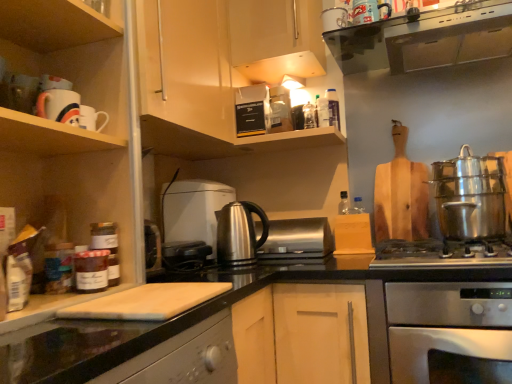
Question: In terms of width, does black granite countertop at center look wider or thinner when compared to metallic silver toaster at upper center, the 1th appliance when ordered from top to bottom?

Choices:
 (A) thin
 (B) wide

Answer: (B)

Question: From the image's perspective, is black granite countertop at center located above or below metallic silver toaster at upper center, acting as the 2th appliance starting from the bottom?

Choices:
 (A) above
 (B) below

Answer: (B)

Question: Which object is positioned closest to the stainless steel gas stove at lower right?

Choices:
 (A) wooden cutting board at upper left, acting as the first cabinetry starting from the front
 (B) black granite countertop at center
 (C) black glass range hood at upper center
 (D) metallic stainless steel kettle at center, positioned as the 1th kitchen appliance in back-to-front order
 (E) satin silver toaster at center, arranged as the second appliance when viewed from the back

Answer: (B)

Question: Which object is positioned closest to the black glass range hood at upper center?

Choices:
 (A) stainless steel gas stove at lower right
 (B) metallic stainless steel kettle at center, which appears as the second kitchen appliance when viewed from the front
 (C) stainless steel kettle at center, the 1th kitchen appliance positioned from the front
 (D) matte wood cabinet at upper center, positioned as the 2th cabinetry in back-to-front order
 (E) metallic silver toaster at upper center, acting as the 2th appliance starting from the bottom

Answer: (D)